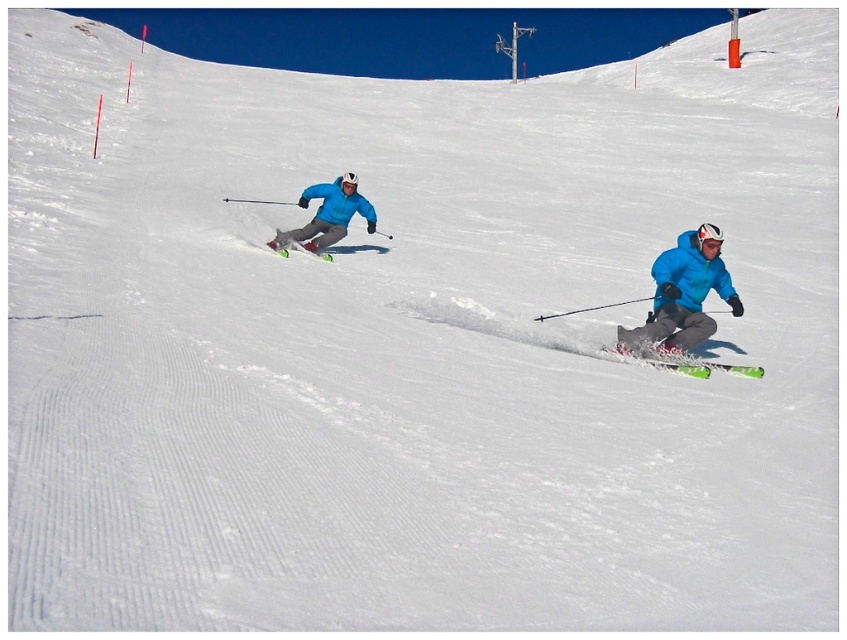
Question: Estimate the real-world distances between objects in this image. Which object is closer to the blue matte jacket at center?

Choices:
 (A) green matte ski at left
 (B) green glossy ski at lower right

Answer: (A)

Question: Is green glossy ski at lower right to the right of green matte ski at left from the viewer's perspective?

Choices:
 (A) yes
 (B) no

Answer: (A)

Question: Which object is the farthest from the green matte ski at left?

Choices:
 (A) green glossy ski at lower right
 (B) blue matte jacket at center

Answer: (A)

Question: Is blue matte jacket at center to the right of green glossy ski at lower right from the viewer's perspective?

Choices:
 (A) yes
 (B) no

Answer: (B)

Question: In this image, where is blue matte jacket at center located relative to green glossy ski at lower right?

Choices:
 (A) right
 (B) left

Answer: (B)

Question: Among these objects, which one is farthest from the camera?

Choices:
 (A) blue matte jacket at center
 (B) green glossy ski at lower right
 (C) green matte ski at left

Answer: (C)